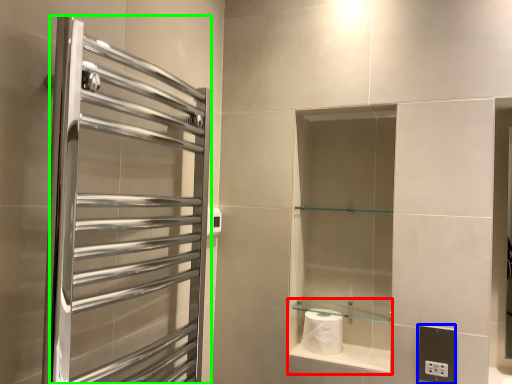
Question: Estimate the real-world distances between objects in this image. Which object is farther from cabinet (highlighted by a red box), electric outlet (highlighted by a blue box) or screen door (highlighted by a green box)?

Choices:
 (A) electric outlet
 (B) screen door

Answer: (B)